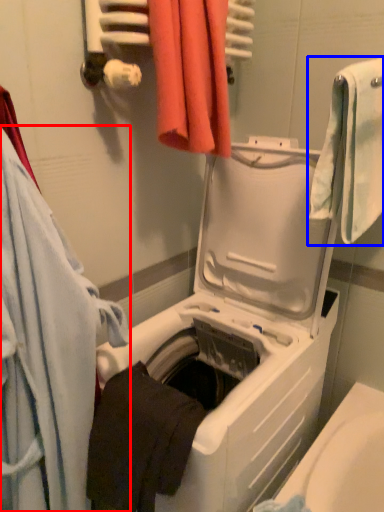
Question: Which of the following is the farthest to the observer, towel (highlighted by a red box) or towel (highlighted by a blue box)?

Choices:
 (A) towel
 (B) towel

Answer: (B)